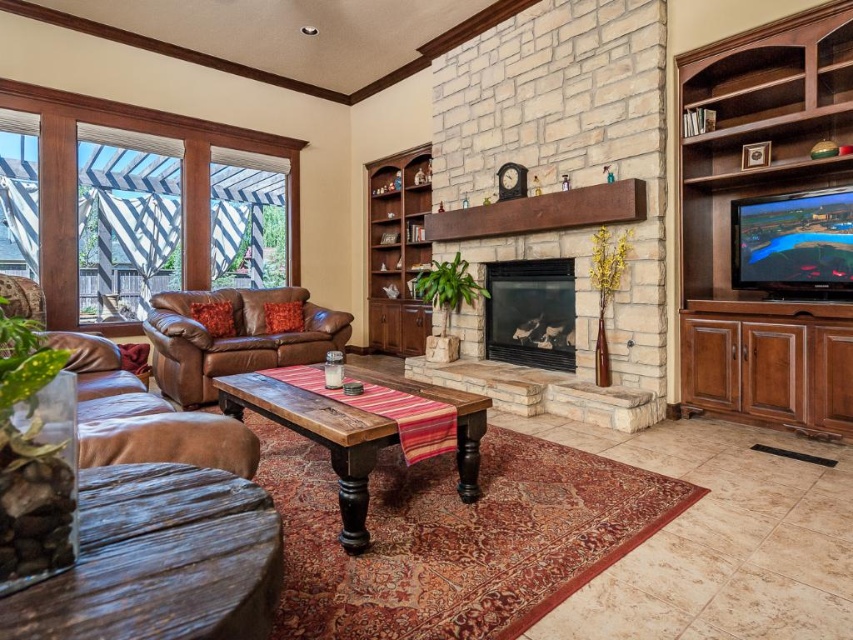
How far apart are brown wood bookshelf at center and black glass fireplace at center?

brown wood bookshelf at center and black glass fireplace at center are 5.32 feet apart.

Does brown wood bookshelf at center have a greater width compared to black glass fireplace at center?

Yes.

I want to click on brown wood bookshelf at center, so click(x=397, y=250).

Can you confirm if mahogany wood entertainment center at right is shorter than brown wood bookshelf at center?

No.

Between point (694, 100) and point (409, 353), which one is positioned in front?

Point (694, 100)

What do you see at coordinates (759, 195) in the screenshot? This screenshot has height=640, width=853. I see `mahogany wood entertainment center at right` at bounding box center [759, 195].

At what (x,y) coordinates should I click in order to perform the action: click on mahogany wood entertainment center at right. Please return your answer as a coordinate pair (x, y). The height and width of the screenshot is (640, 853). Looking at the image, I should click on (759, 195).

This screenshot has height=640, width=853. Identify the location of mahogany wood entertainment center at right. (759, 195).

Is point (717, 236) farther from viewer compared to point (108, 410)?

Yes.

Identify the location of mahogany wood entertainment center at right. The width and height of the screenshot is (853, 640). (759, 195).

Locate an element on the screen. mahogany wood entertainment center at right is located at coordinates (759, 195).